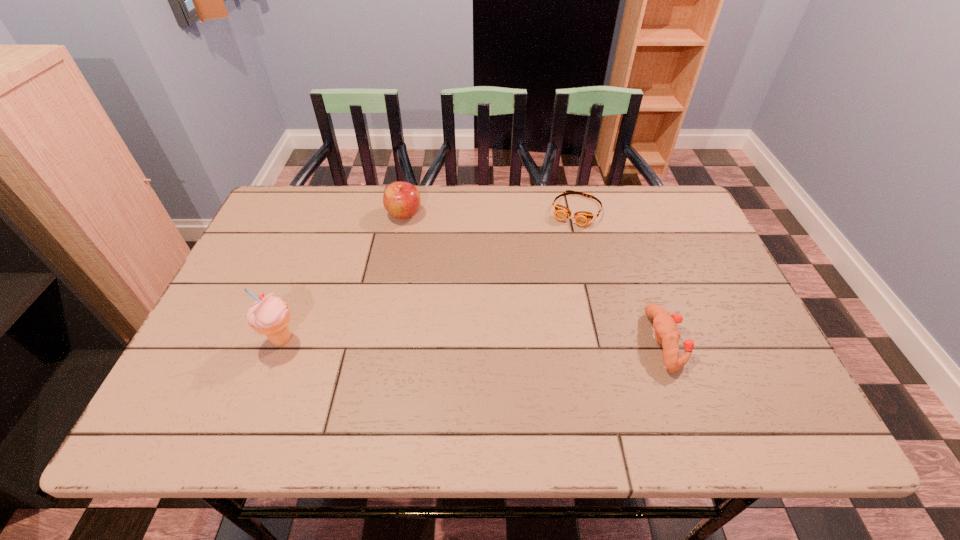
At what (x,y) coordinates should I click in order to perform the action: click on vacant area at the far edge of the desktop. Please return your answer as a coordinate pair (x, y). Looking at the image, I should click on (620, 229).

I want to click on vacant region at the near edge of the desktop, so click(x=594, y=364).

At what (x,y) coordinates should I click in order to perform the action: click on vacant area at the left edge. Please return your answer as a coordinate pair (x, y). Looking at the image, I should click on (291, 248).

The width and height of the screenshot is (960, 540). I want to click on vacant space at the right edge of the desktop, so click(681, 247).

The width and height of the screenshot is (960, 540). In the image, there is a desktop. Identify the location of vacant space at the far left corner. (266, 221).

Locate an element on the screen. The width and height of the screenshot is (960, 540). vacant area at the far right corner of the desktop is located at coordinates (664, 234).

In the image, there is a desktop. Identify the location of free space at the near right corner. (768, 362).

Find the location of a particular element. vacant area that lies between the third object from left to right and the icecream is located at coordinates (429, 275).

This screenshot has width=960, height=540. I want to click on free space between the puncher and the goggles, so click(621, 276).

Where is `unoccupied area between the second object from left to right and the icecream`? This screenshot has width=960, height=540. unoccupied area between the second object from left to right and the icecream is located at coordinates (343, 277).